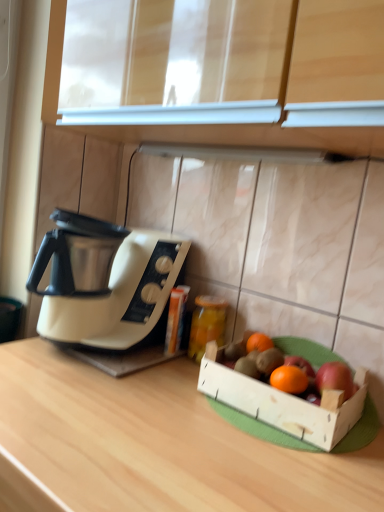
This screenshot has width=384, height=512. Identify the location of free space in front of white plastic coffee maker at left. (100, 411).